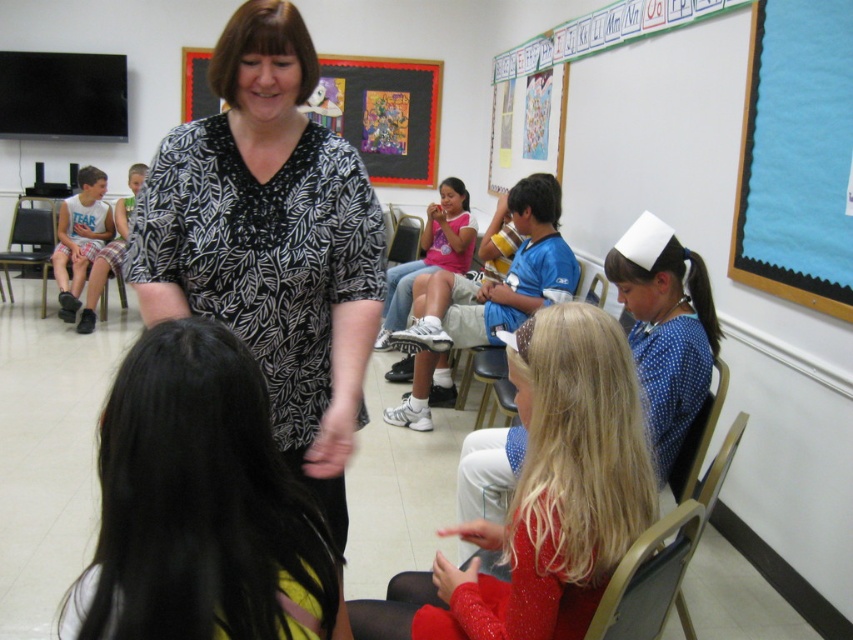
In the classroom scene, there is a black matte bulletin board at upper center and a pink fabric shirt at center. From the perspective of someone standing in front of the classroom, which object is positioned to the left?

The black matte bulletin board at upper center is to the left of the pink fabric shirt at center.

You are a photographer standing at the front of the classroom. You want to take a photo of both the point at (347,74) and the point at (426,252). Which point is closer to your camera?

Point (347,74) is closer to the camera than point (426,252) because it is further to the camera than the other point.

You are a student in the classroom and want to sit down. There is a brown plastic chair at lower right and a pink fabric shirt at center. Which object should you approach to sit?

You should approach the brown plastic chair at lower right because it is positioned under the pink fabric shirt at center, which likely means the chair is beneath the shirt wearer, making it available for sitting.